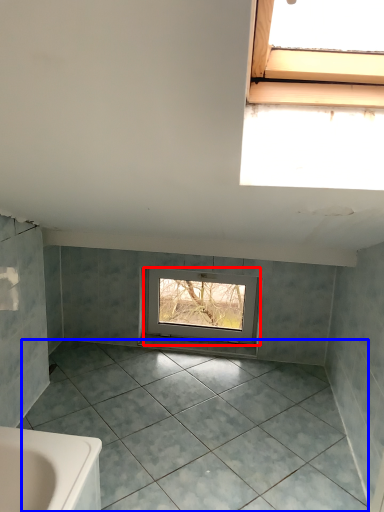
Question: Which point is further to the camera, window (highlighted by a red box) or ceramic tile (highlighted by a blue box)?

Choices:
 (A) window
 (B) ceramic tile

Answer: (A)